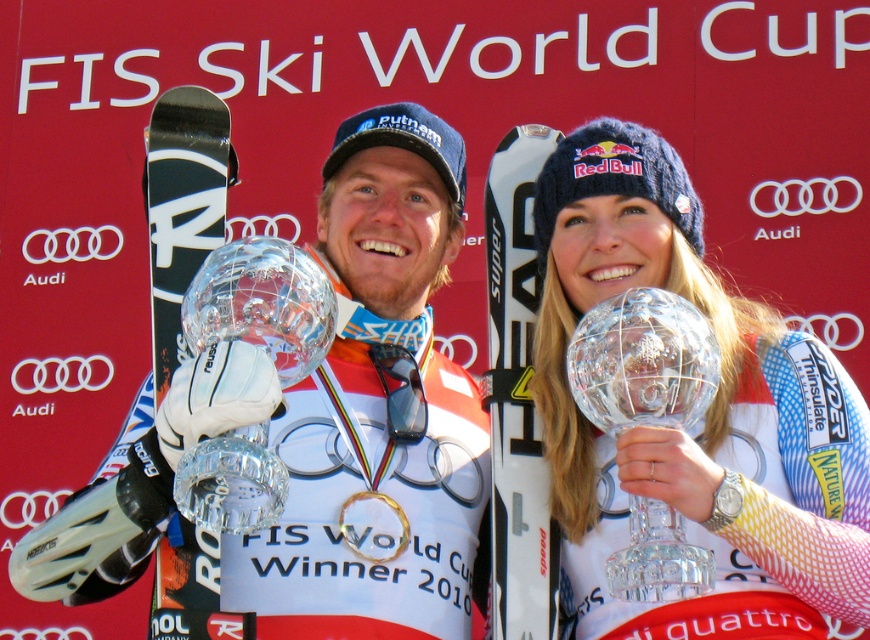
Which is in front, point (231, 529) or point (351, 515)?

Point (231, 529)

Is point (272, 305) closer to viewer compared to point (392, 550)?

That is True.

Is point (196, 330) closer to viewer compared to point (365, 525)?

Yes, it is in front of point (365, 525).

This screenshot has width=870, height=640. I want to click on clear glass globe at center, so 262,304.

Is matte white trophy at center to the left of transparent crystal trophy at center from the viewer's perspective?

In fact, matte white trophy at center is to the right of transparent crystal trophy at center.

Between point (596, 216) and point (661, 515), which one is positioned behind?

The point (596, 216) is behind.

Locate an element on the screen. matte white trophy at center is located at coordinates (708, 406).

Between matte black snowboard at center and gold plated ring at center, which one is positioned lower?

matte black snowboard at center is below.

Describe the element at coordinates (300, 413) in the screenshot. I see `matte black snowboard at center` at that location.

Does point (204, 417) come behind point (405, 538)?

No, (204, 417) is in front of (405, 538).

Where is `matte black snowboard at center`? matte black snowboard at center is located at coordinates (300, 413).